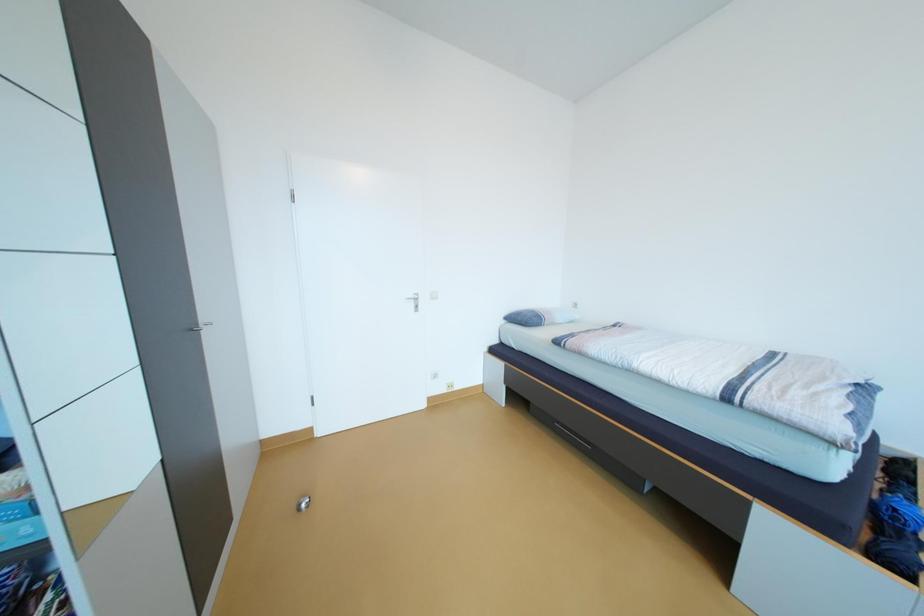
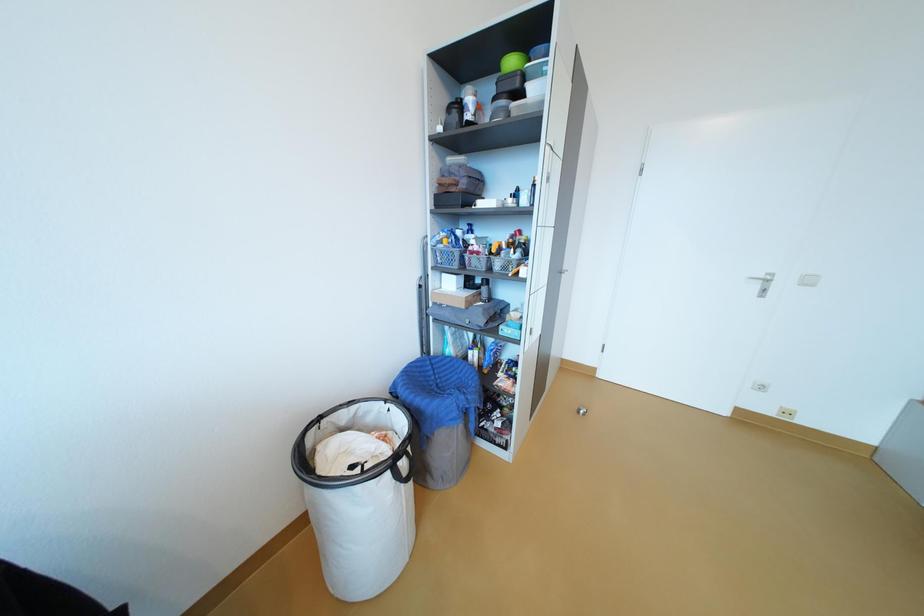
Question: How did the camera likely rotate?

Choices:
 (A) Left
 (B) Right
 (C) Up
 (D) Down

Answer: (A)